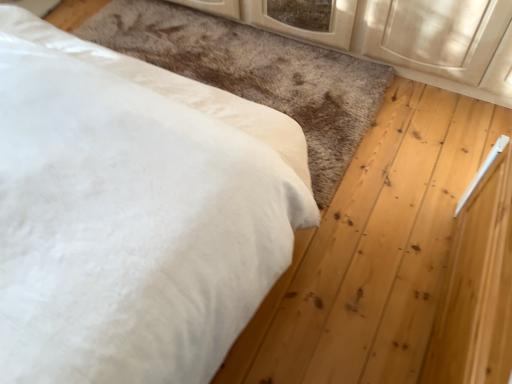
Question: Choose the correct answer: Is white soft rug at lower left inside white soft bed at upper left or outside it?

Choices:
 (A) outside
 (B) inside

Answer: (A)

Question: In the image, is white soft rug at lower left positioned in front of or behind white soft bed at upper left?

Choices:
 (A) front
 (B) behind

Answer: (B)

Question: Considering the positions of point pyautogui.click(x=339, y=66) and point pyautogui.click(x=134, y=206), is point pyautogui.click(x=339, y=66) closer or farther from the camera than point pyautogui.click(x=134, y=206)?

Choices:
 (A) closer
 (B) farther

Answer: (B)

Question: From a real-world perspective, is white soft bed at upper left physically located above or below white soft rug at lower left?

Choices:
 (A) above
 (B) below

Answer: (A)

Question: From the image's perspective, is white soft bed at upper left above or below white soft rug at lower left?

Choices:
 (A) above
 (B) below

Answer: (B)

Question: Relative to white soft rug at lower left, is white soft bed at upper left in front or behind?

Choices:
 (A) behind
 (B) front

Answer: (B)

Question: Choose the correct answer: Is white soft bed at upper left inside white soft rug at lower left or outside it?

Choices:
 (A) outside
 (B) inside

Answer: (A)